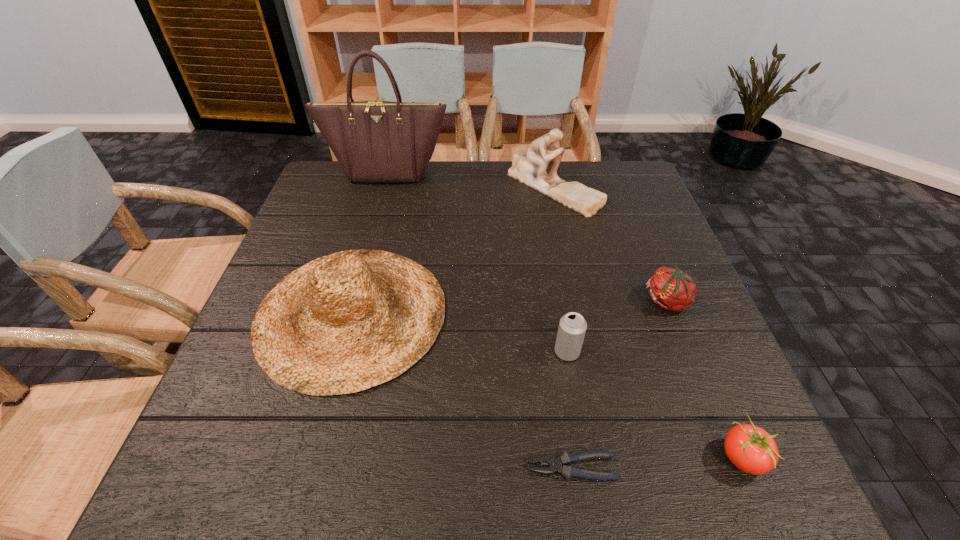
At what (x,y) coordinates should I click in order to perform the action: click on free space that is in between the nearer tomato and the sunhat. Please return your answer as a coordinate pair (x, y). The image size is (960, 540). Looking at the image, I should click on (546, 385).

In order to click on free area in between the beer can and the figurine in this screenshot , I will do `click(561, 269)`.

Identify the location of empty space between the nearer tomato and the sunhat. (546, 385).

Where is `vacant region between the handbag and the sixth shortest object`? vacant region between the handbag and the sixth shortest object is located at coordinates (470, 179).

You are a GUI agent. You are given a task and a screenshot of the screen. Output one action in this format:
    pyautogui.click(x=<x>, y=<y>)
    Task: Click on the free space that is in between the shortest object and the handbag
    
    Given the screenshot: What is the action you would take?
    479,320

Find the location of a particular element. This screenshot has height=540, width=960. vacant region between the shortest object and the beer can is located at coordinates (569, 410).

Find the location of a particular element. free spot between the farther tomato and the nearer tomato is located at coordinates (705, 379).

You are a GUI agent. You are given a task and a screenshot of the screen. Output one action in this format:
    pyautogui.click(x=<x>, y=<y>)
    Task: Click on the empty location between the farther tomato and the nearer tomato
    This screenshot has width=960, height=540.
    Given the screenshot: What is the action you would take?
    pyautogui.click(x=705, y=379)

This screenshot has height=540, width=960. Identify the location of free area in between the handbag and the figurine. (470, 179).

Image resolution: width=960 pixels, height=540 pixels. Find the location of `blank region between the farther tomato and the shortest object`. blank region between the farther tomato and the shortest object is located at coordinates (619, 384).